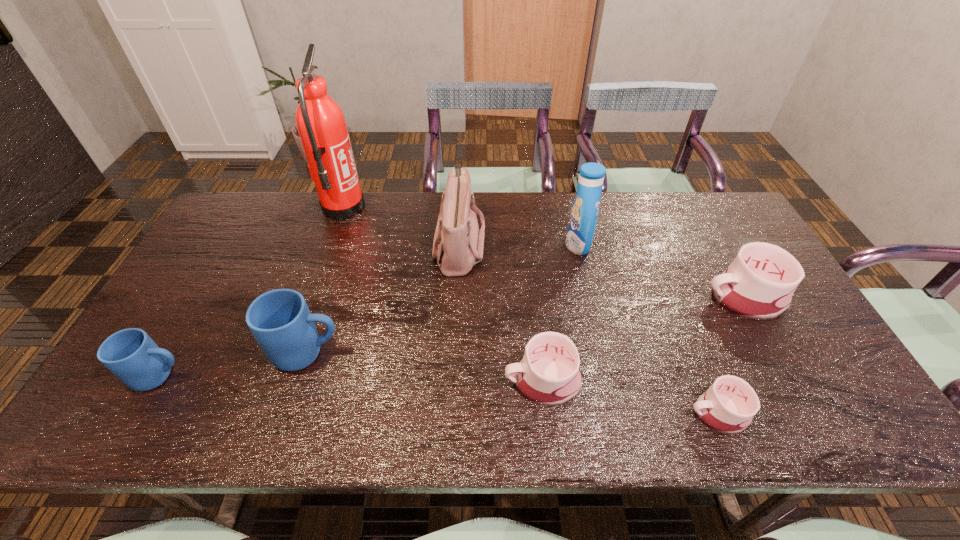
Where is `vacant space located 0.280m on the side with the handle of the rightmost object`? vacant space located 0.280m on the side with the handle of the rightmost object is located at coordinates (602, 298).

Where is `free location located on the side with the handle of the rightmost object`? This screenshot has height=540, width=960. free location located on the side with the handle of the rightmost object is located at coordinates (656, 298).

You are a GUI agent. You are given a task and a screenshot of the screen. Output one action in this format:
    pyautogui.click(x=<x>, y=<y>)
    Task: Click on the free space located 0.290m on the side with the handle of the rightmost object
    The width and height of the screenshot is (960, 540).
    Given the screenshot: What is the action you would take?
    pyautogui.click(x=598, y=298)

Image resolution: width=960 pixels, height=540 pixels. What are the coordinates of `vacant point located on the side of the leftmost object with the handle` in the screenshot? It's located at (264, 376).

Where is `vacant space situated 0.360m on the side with the handle of the second shortest mug`? The image size is (960, 540). vacant space situated 0.360m on the side with the handle of the second shortest mug is located at coordinates (352, 381).

The image size is (960, 540). I want to click on vacant space located 0.150m on the side with the handle of the second shortest mug, so click(x=441, y=381).

Image resolution: width=960 pixels, height=540 pixels. In order to click on free location located on the side with the handle of the second shortest mug in this screenshot , I will do `click(458, 381)`.

The width and height of the screenshot is (960, 540). I want to click on vacant space located 0.060m on the side with the handle of the shortest object, so click(x=660, y=414).

Image resolution: width=960 pixels, height=540 pixels. I want to click on vacant space positioned 0.160m on the side with the handle of the shortest object, so click(616, 414).

What are the coordinates of `vacant space located on the side with the handle of the shortest object` in the screenshot? It's located at (598, 414).